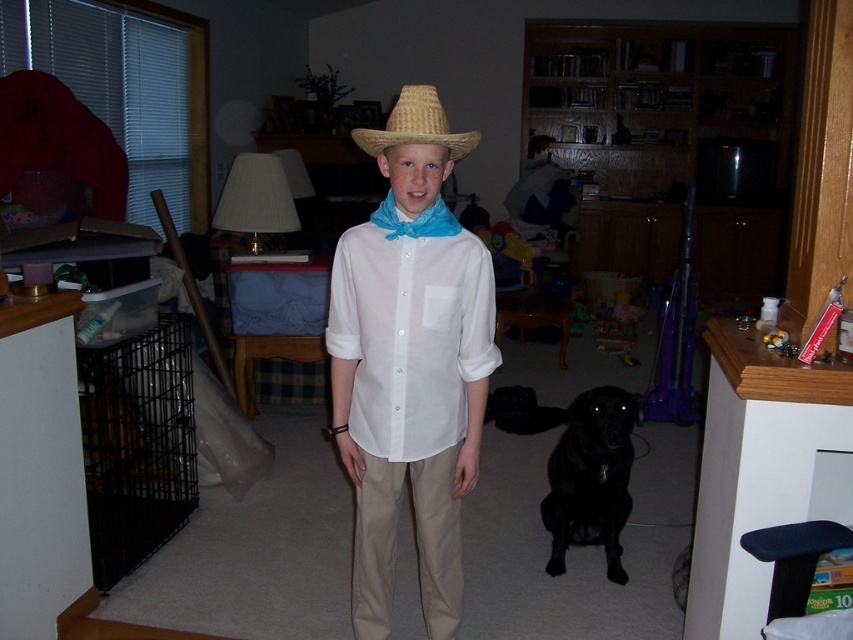
The user is trying to locate the khaki cotton pants at center and the black glossy dog at lower center in the image. Based on their positions, which object is closer to the left side of the image?

The khaki cotton pants at center are to the left of the black glossy dog at lower center, so the khaki cotton pants at center are closer to the left side of the image.